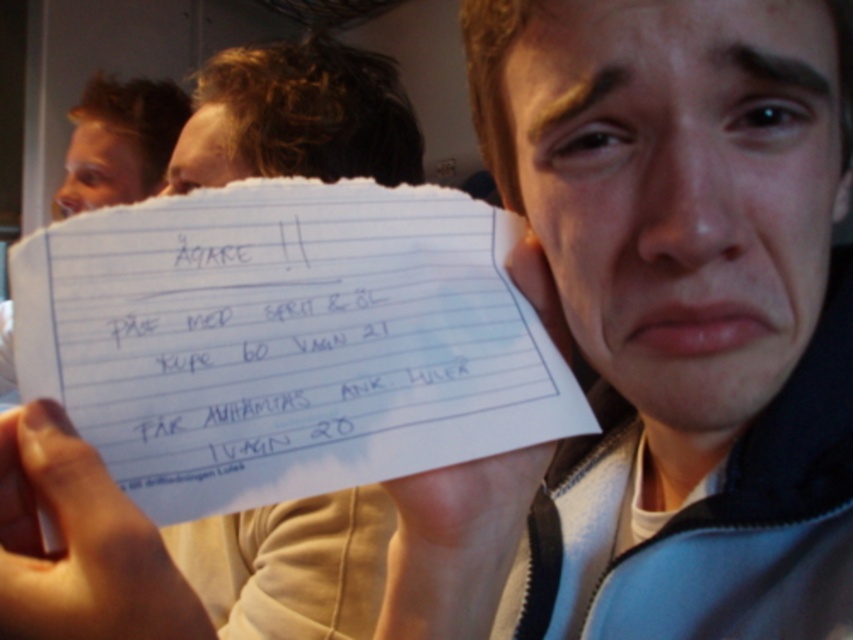
What is the relationship between the width of the white lined paper at center and the white paper at center?

The white lined paper at center is wider than the white paper at center.

You are a delivery person standing at the entrance of a building. You need to deliver a package to a specific location marked by the point at coordinates point [740,266]. The delivery requires you to be within 30 centimeters of the point to scan it. Can you successfully scan the package at this distance?

The point at coordinates point [740,266] is 31.10 centimeters away from the viewer. Since the required distance to scan is within 30 centimeters, the delivery person cannot successfully scan the package at this distance.